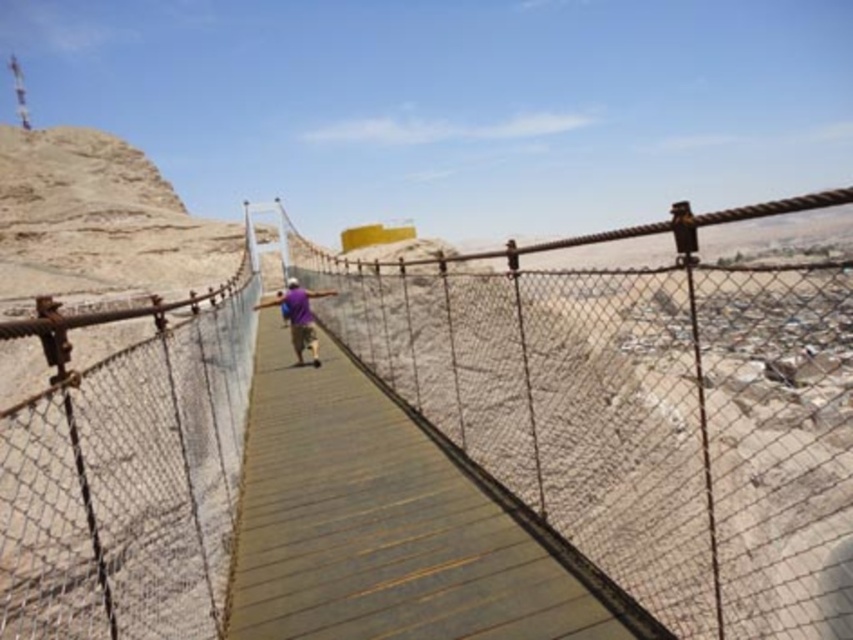
Between rusty metal suspension bridge at center and purple fabric shirt at center, which one is positioned lower?

purple fabric shirt at center

Is rusty metal suspension bridge at center further to the viewer compared to purple fabric shirt at center?

No, rusty metal suspension bridge at center is closer to the viewer.

Which is behind, point (428, 353) or point (292, 320)?

Positioned behind is point (428, 353).

Find the location of a particular element. This screenshot has height=640, width=853. rusty metal suspension bridge at center is located at coordinates (637, 416).

Is rusty metal suspension bridge at center bigger than wooden at center?

Indeed, rusty metal suspension bridge at center has a larger size compared to wooden at center.

Which of these two, rusty metal suspension bridge at center or wooden at center, stands shorter?

wooden at center

Find the location of a particular element. rusty metal suspension bridge at center is located at coordinates (637, 416).

Does wooden at center have a lesser width compared to purple fabric shirt at center?

Correct, wooden at center's width is less than purple fabric shirt at center's.

Who is more distant from viewer, [409,508] or [289,307]?

The point [289,307] is behind.

This screenshot has height=640, width=853. What are the coordinates of `wooden at center` in the screenshot? It's located at (392, 525).